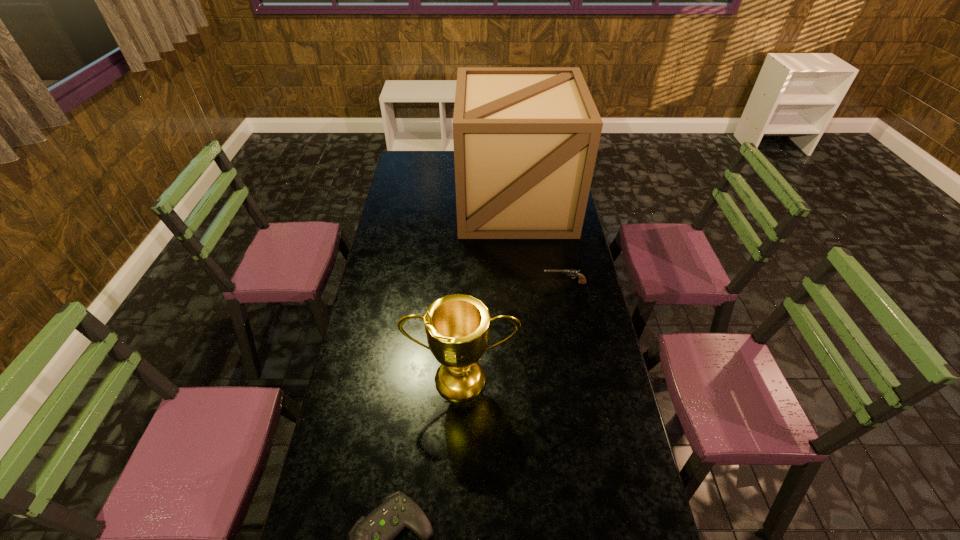
This screenshot has width=960, height=540. In order to click on free space between the farthest object and the award in this screenshot , I will do `click(489, 291)`.

Where is `free spot between the farthest object and the third shortest object`? free spot between the farthest object and the third shortest object is located at coordinates (489, 291).

Locate an element on the screen. The image size is (960, 540). vacant space that is in between the award and the box is located at coordinates (489, 291).

Where is `vacant space that's between the gun and the second tallest object`? The width and height of the screenshot is (960, 540). vacant space that's between the gun and the second tallest object is located at coordinates (514, 331).

Locate an element on the screen. Image resolution: width=960 pixels, height=540 pixels. object identified as the closest to the control is located at coordinates (457, 326).

Identify the location of the third closest object to the third farthest object. (526, 139).

At what (x,y) coordinates should I click in order to perform the action: click on free space that satisfies the following two spatial constraints: 1. aiming along the barrel of the second farthest object; 2. on the shiny surface of the third farthest object. Please return your answer as a coordinate pair (x, y). Looking at the image, I should click on (583, 379).

The image size is (960, 540). What are the coordinates of `vacant space that satisfies the following two spatial constraints: 1. aiming along the barrel of the second farthest object; 2. on the shiny surface of the third shortest object` in the screenshot? It's located at (583, 379).